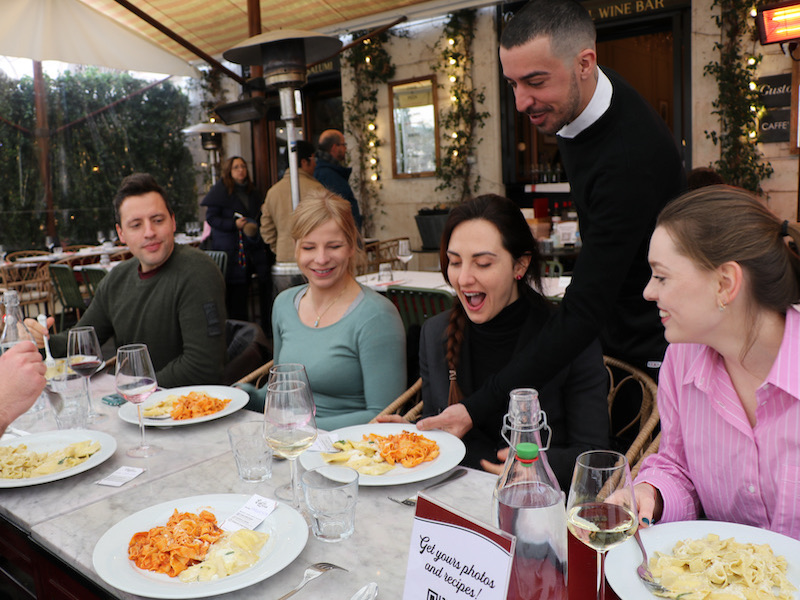
Find the location of a particular element. This screenshot has width=800, height=600. round white plates is located at coordinates (85, 458), (54, 376), (230, 406), (236, 582), (434, 466), (670, 531).